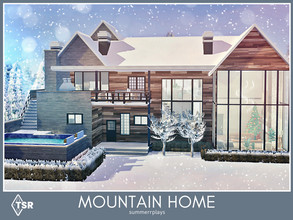
Where is `stairs`? Image resolution: width=293 pixels, height=220 pixels. stairs is located at coordinates (32, 113).